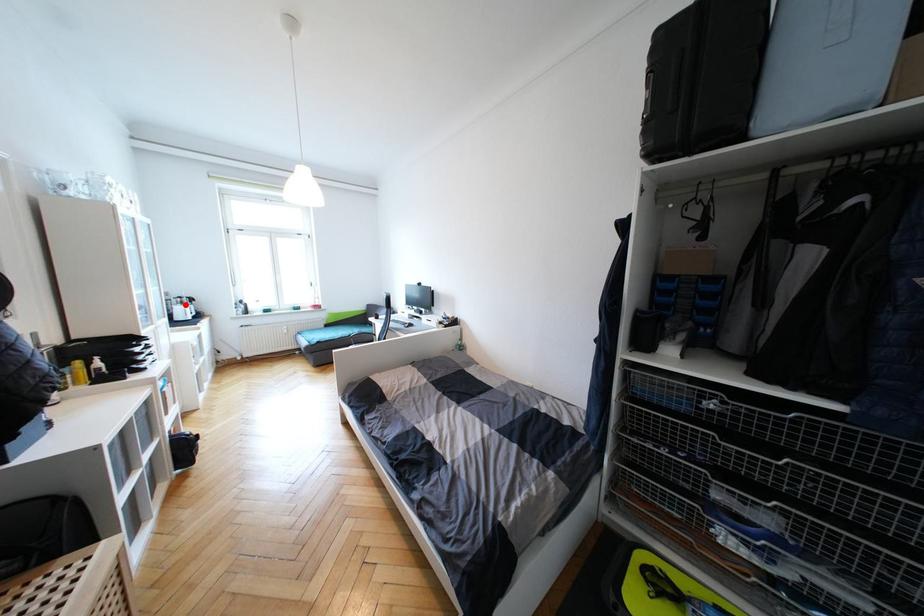
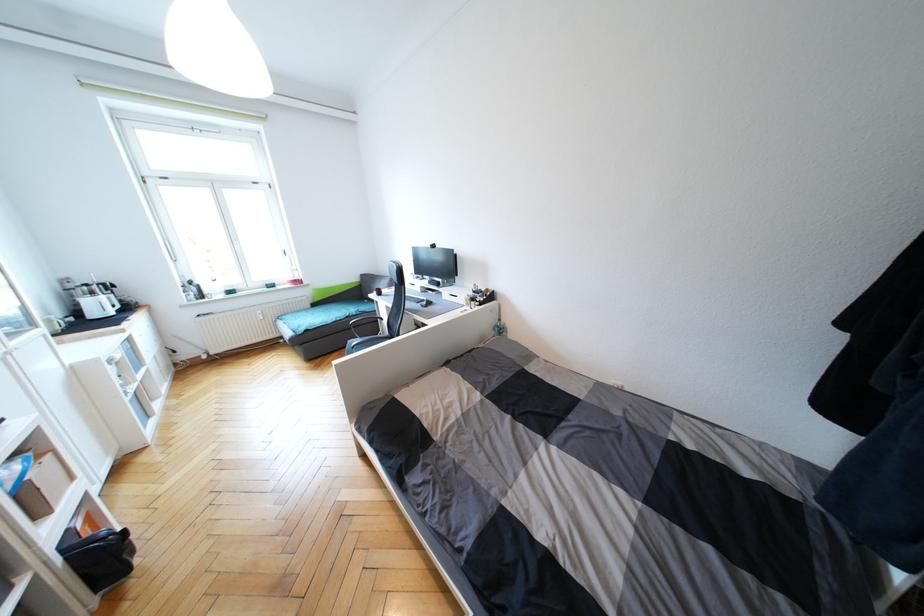
Where in the second image is the point corresponding to the highlighted location from the first image?

(95, 294)